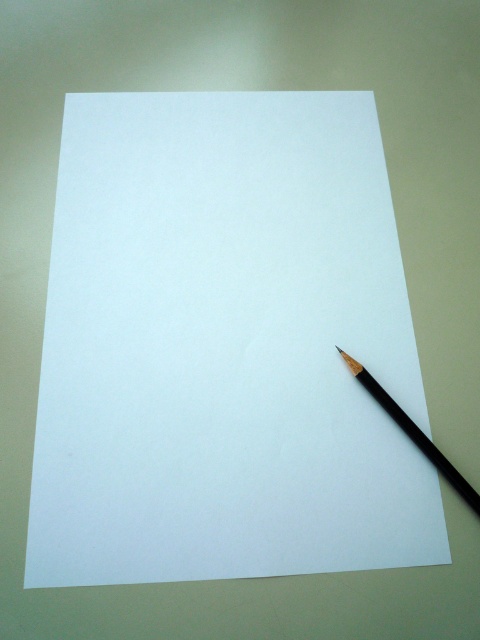
Question: Is white paper at center closer to camera compared to black matte pencil at lower right?

Choices:
 (A) no
 (B) yes

Answer: (B)

Question: Is white paper at center smaller than black matte pencil at lower right?

Choices:
 (A) no
 (B) yes

Answer: (A)

Question: Does white paper at center appear over black matte pencil at lower right?

Choices:
 (A) no
 (B) yes

Answer: (B)

Question: Among these points, which one is nearest to the camera?

Choices:
 (A) (470, 488)
 (B) (227, 308)

Answer: (A)